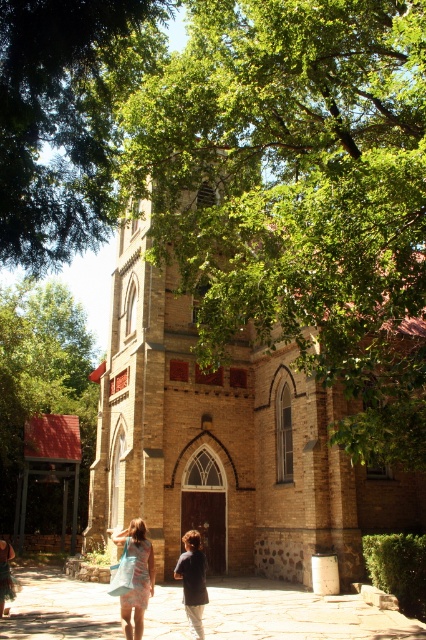
Can you confirm if green leafy tree at upper center is thinner than light blue fabric dress at lower center?

Incorrect, green leafy tree at upper center's width is not less than light blue fabric dress at lower center's.

Who is shorter, green leafy tree at upper center or light blue fabric dress at lower center?

light blue fabric dress at lower center is shorter.

What do you see at coordinates (66, 118) in the screenshot?
I see `green leafy tree at upper center` at bounding box center [66, 118].

Identify the location of green leafy tree at upper center. (66, 118).

Does green leafy tree at upper left appear under dark blue shirt at center?

Actually, green leafy tree at upper left is above dark blue shirt at center.

Between green leafy tree at upper left and dark blue shirt at center, which one appears on the right side from the viewer's perspective?

dark blue shirt at center is more to the right.

This screenshot has width=426, height=640. What do you see at coordinates (42, 378) in the screenshot? I see `green leafy tree at upper left` at bounding box center [42, 378].

Where is `green leafy tree at upper left`? The width and height of the screenshot is (426, 640). green leafy tree at upper left is located at coordinates (42, 378).

Is green leafy tree at upper center to the right of dark blue shirt at center from the viewer's perspective?

Incorrect, green leafy tree at upper center is not on the right side of dark blue shirt at center.

Describe the element at coordinates (66, 118) in the screenshot. This screenshot has width=426, height=640. I see `green leafy tree at upper center` at that location.

At what (x,y) coordinates should I click in order to perform the action: click on green leafy tree at upper center. Please return your answer as a coordinate pair (x, y). This screenshot has height=640, width=426. Looking at the image, I should click on (66, 118).